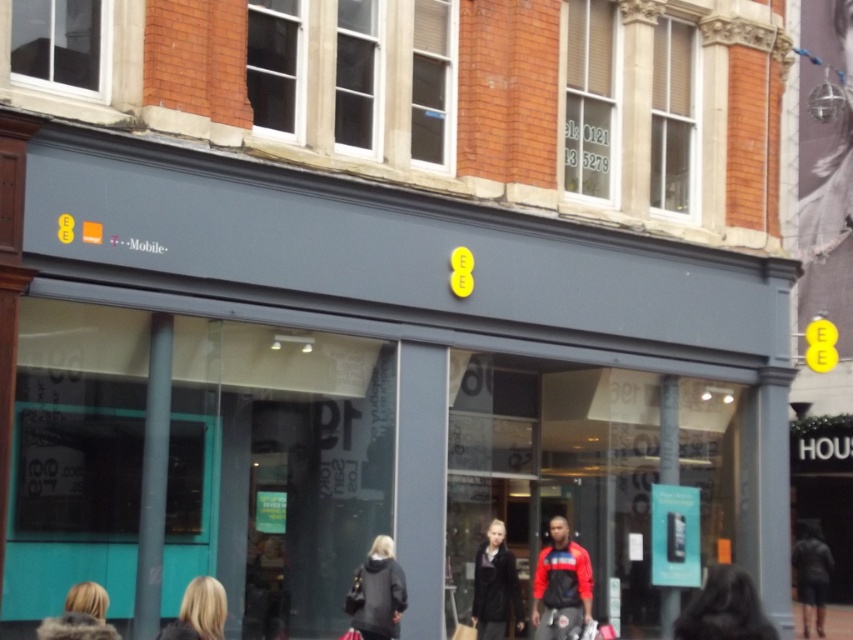
Does point (816, 611) lie behind point (202, 625)?

That is True.

The height and width of the screenshot is (640, 853). I want to click on dark gray jacket at lower right, so click(811, 576).

Identify the location of dark gray jacket at lower right. (811, 576).

Who is positioned more to the left, dark gray fur at lower right or blonde hair at lower center?

From the viewer's perspective, blonde hair at lower center appears more on the left side.

Which is below, dark gray fur at lower right or blonde hair at lower center?

dark gray fur at lower right is lower down.

Which is in front, point (715, 604) or point (186, 609)?

Point (186, 609)

You are a GUI agent. You are given a task and a screenshot of the screen. Output one action in this format:
    pyautogui.click(x=<x>, y=<y>)
    Task: Click on the dark gray fur at lower right
    The height and width of the screenshot is (640, 853).
    Given the screenshot: What is the action you would take?
    [724, 609]

Is point (397, 563) behind point (86, 614)?

Yes, it is.

Can you confirm if dark gray coat at lower center is shorter than blonde fur coat at lower left?

No.

This screenshot has width=853, height=640. Describe the element at coordinates (378, 593) in the screenshot. I see `dark gray coat at lower center` at that location.

Identify the location of dark gray coat at lower center. (378, 593).